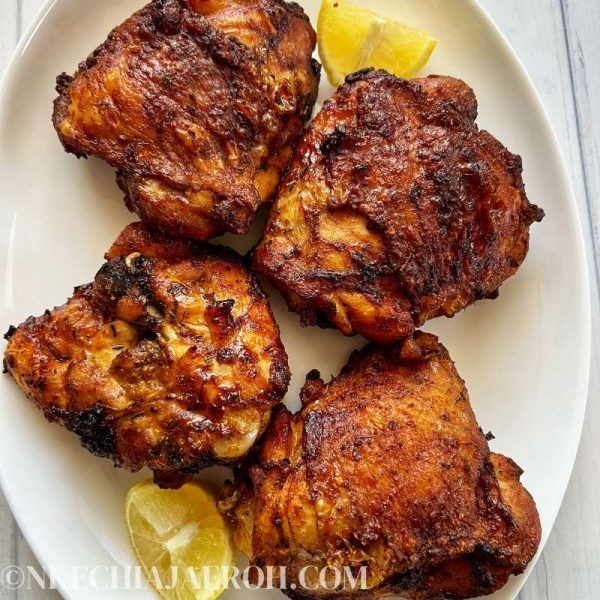
This screenshot has width=600, height=600. In order to click on table in this screenshot , I will do `click(565, 570)`.